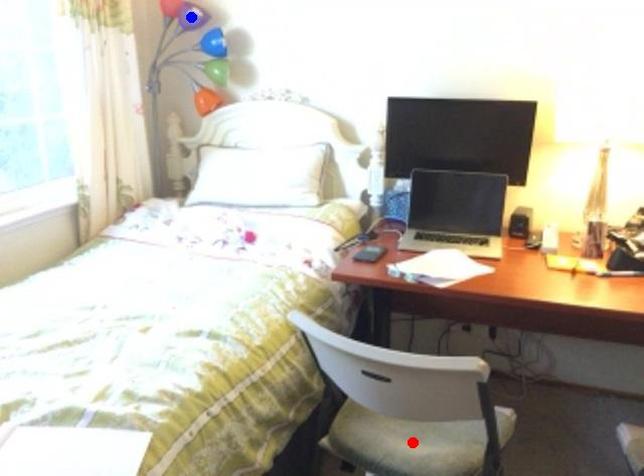
Question: Which of the two points in the image is closer to the camera?

Choices:
 (A) Blue point is closer.
 (B) Red point is closer.

Answer: (B)